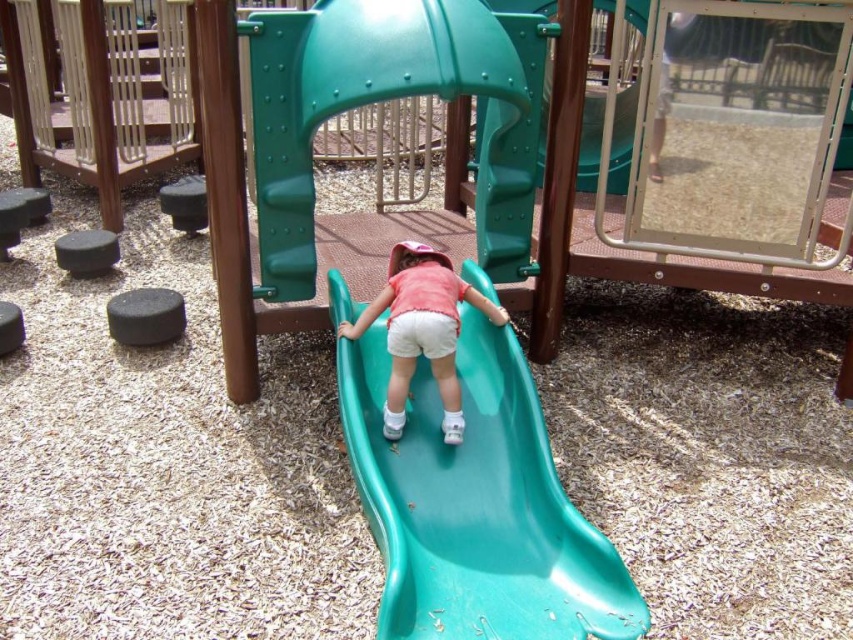
Which is more to the right, green plastic slide at center or matte plastic slide at center?

green plastic slide at center is more to the right.

How far apart are green plastic slide at center and matte plastic slide at center?

green plastic slide at center and matte plastic slide at center are 9.96 inches apart from each other.

Identify the location of green plastic slide at center. (476, 504).